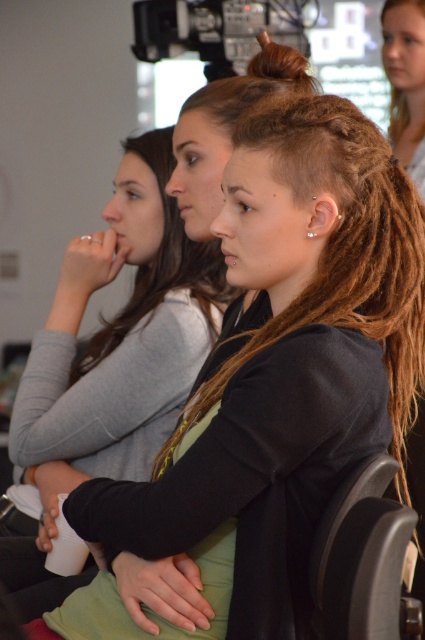
Question: Is brown/dry/dreadlocks at center wider than blonde dreadlocks at upper right?

Choices:
 (A) no
 (B) yes

Answer: (B)

Question: Does black leather chair at lower right have a larger size compared to brown/dry hair at center?

Choices:
 (A) no
 (B) yes

Answer: (A)

Question: Among these objects, which one is farthest from the camera?

Choices:
 (A) brown hair at upper center
 (B) brown/dry/dreadlocks at center
 (C) black leather chair at lower right
 (D) brown/dry hair at center

Answer: (D)

Question: Which of the following is the farthest from the observer?

Choices:
 (A) brown/dry/dreadlocks at center
 (B) black matte shirt at center
 (C) black leather chair at lower right
 (D) brown hair at upper center

Answer: (B)

Question: Does black matte shirt at center appear on the left side of brown/dry hair at center?

Choices:
 (A) no
 (B) yes

Answer: (B)

Question: Which point is farther from the camera taking this photo?

Choices:
 (A) (198, 289)
 (B) (150, 282)

Answer: (B)